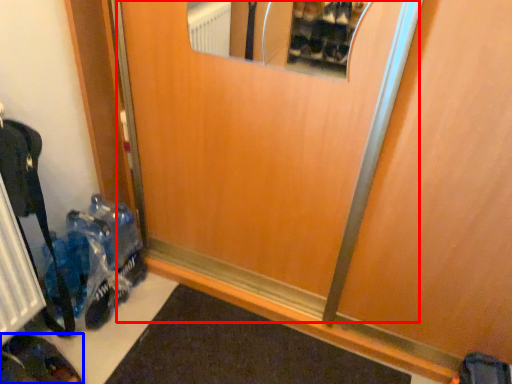
Question: Among these objects, which one is nearest to the camera, elevator door (highlighted by a red box) or footwear (highlighted by a blue box)?

Choices:
 (A) elevator door
 (B) footwear

Answer: (A)